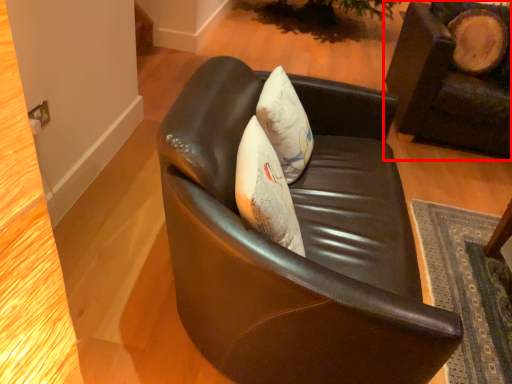
Question: In this image, where is chair (annotated by the red box) located relative to chair?

Choices:
 (A) left
 (B) right

Answer: (B)